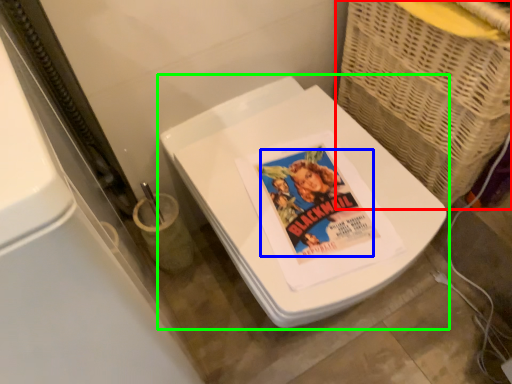
Question: Based on their relative distances, which object is farther from basket (highlighted by a red box)? Choose from comic book character (highlighted by a blue box) and toilet (highlighted by a green box).

Choices:
 (A) comic book character
 (B) toilet

Answer: (A)